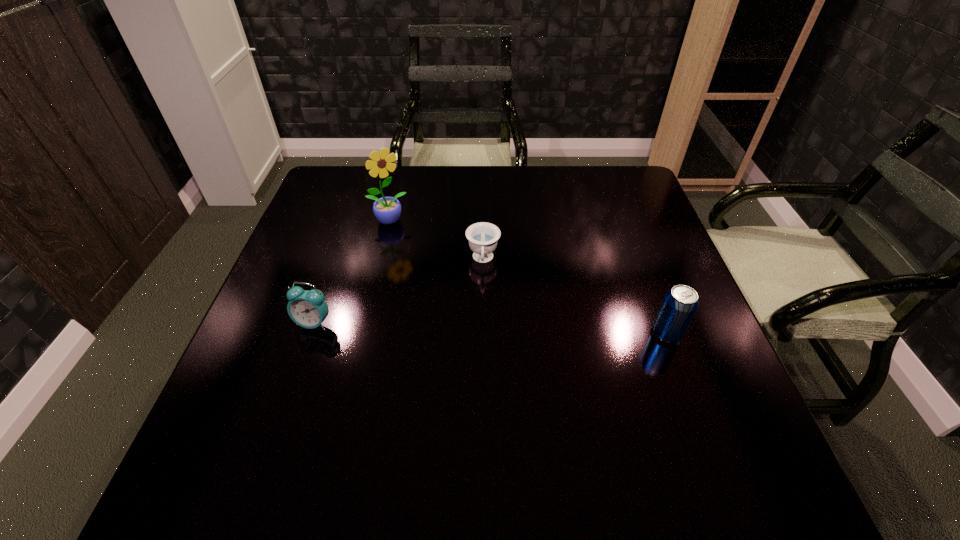
Identify the location of free space at the near left corner. The width and height of the screenshot is (960, 540). (291, 430).

I want to click on vacant area at the far right corner, so click(635, 171).

Where is `vacant space that is in between the alarm clock and the third object from right to left`? This screenshot has width=960, height=540. vacant space that is in between the alarm clock and the third object from right to left is located at coordinates (351, 272).

Image resolution: width=960 pixels, height=540 pixels. In order to click on unoccupied position between the beer can and the leftmost object in this screenshot , I will do (x=491, y=328).

Image resolution: width=960 pixels, height=540 pixels. Identify the location of vacant region between the sunflower and the rightmost object. (528, 277).

The height and width of the screenshot is (540, 960). In order to click on vacant area that lies between the leftmost object and the second farthest object in this screenshot , I will do `click(398, 292)`.

Locate an element on the screen. The height and width of the screenshot is (540, 960). vacant region between the leftmost object and the beer can is located at coordinates (491, 328).

The image size is (960, 540). I want to click on free space that is in between the rightmost object and the farthest object, so click(x=528, y=277).

The width and height of the screenshot is (960, 540). I want to click on blank region between the leftmost object and the second farthest object, so click(398, 292).

You are a GUI agent. You are given a task and a screenshot of the screen. Output one action in this format:
    pyautogui.click(x=<x>, y=<y>)
    Task: Click on the free space between the third nearest object and the tallest object
    
    Given the screenshot: What is the action you would take?
    pyautogui.click(x=436, y=240)